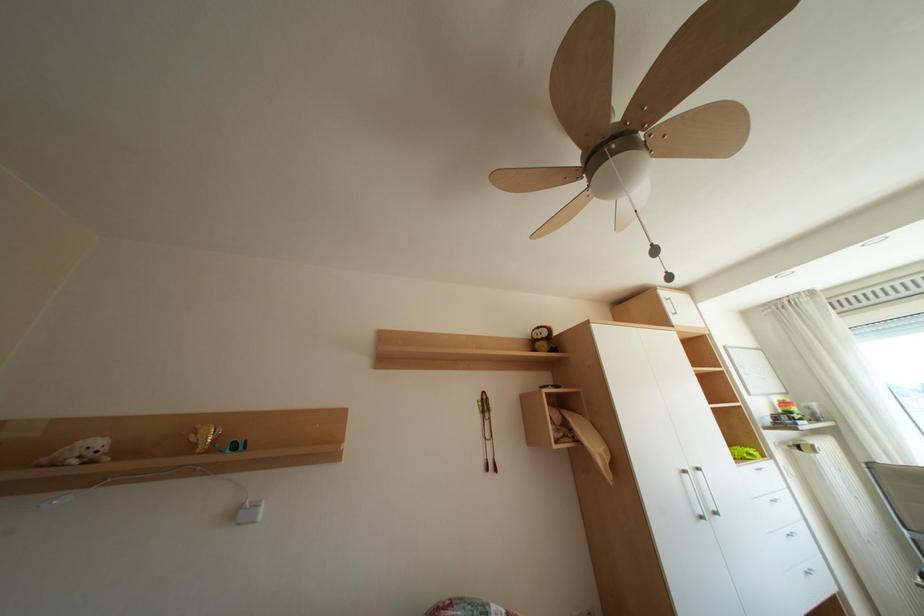
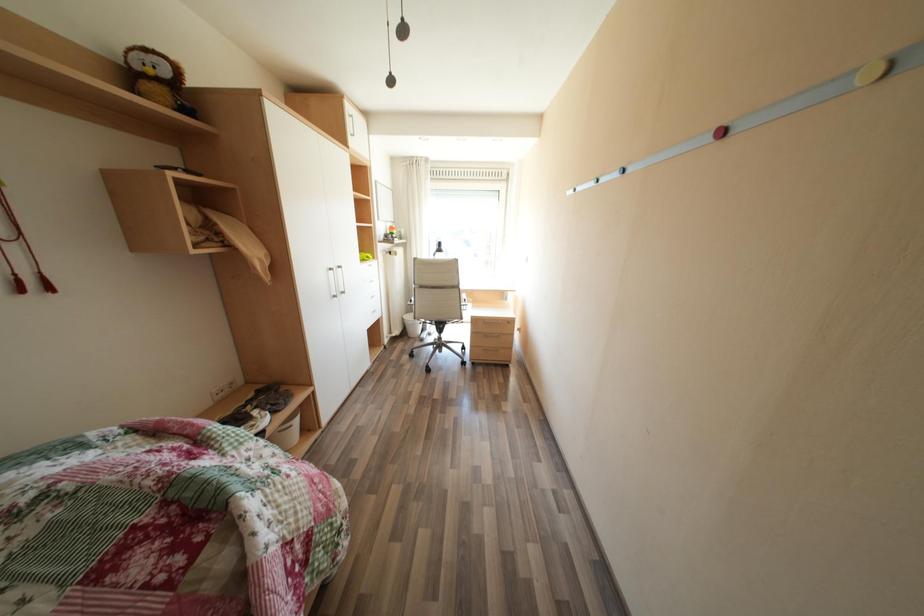
How did the camera likely rotate?

The camera's rotation is toward right-down.